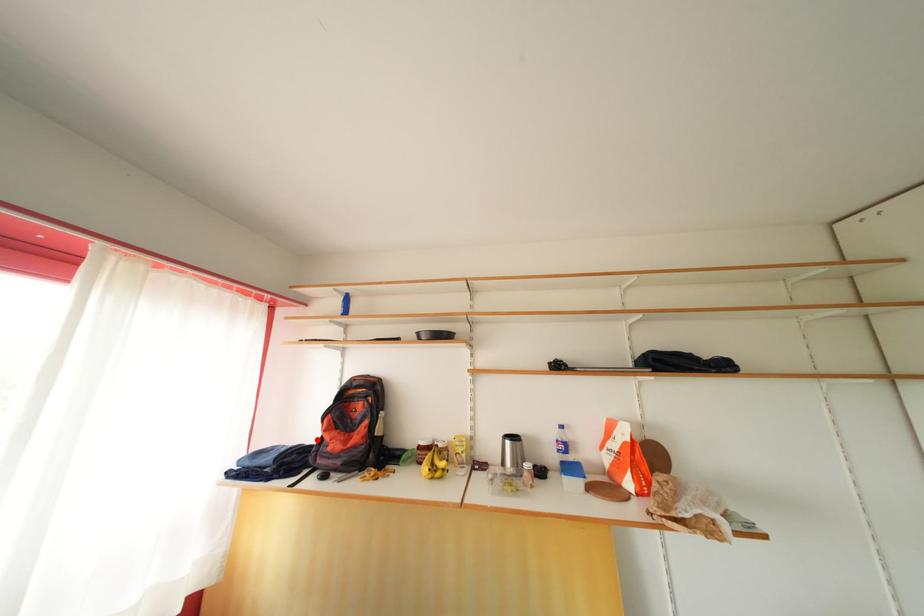
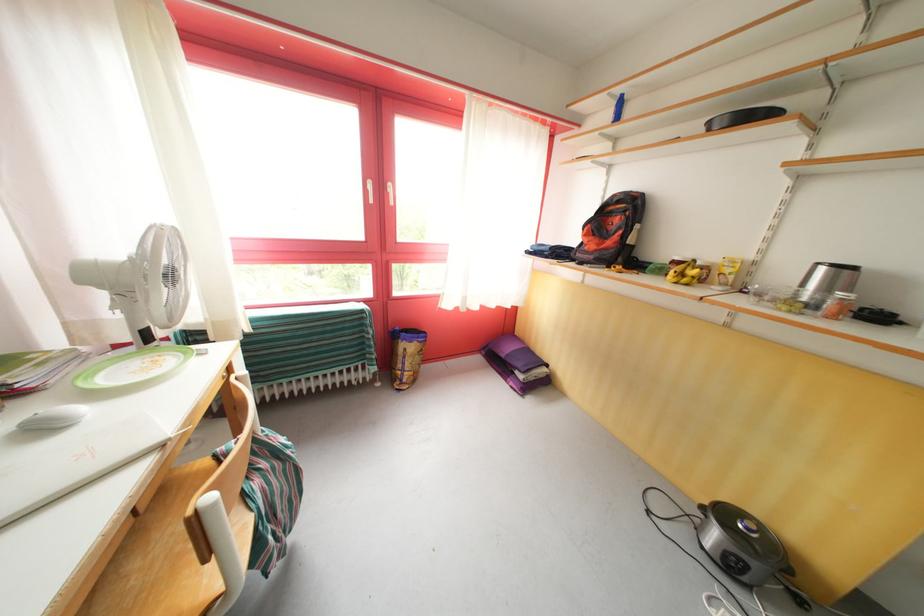
Find the pixel in the second image that matches the highlighted location in the first image.

(580, 245)